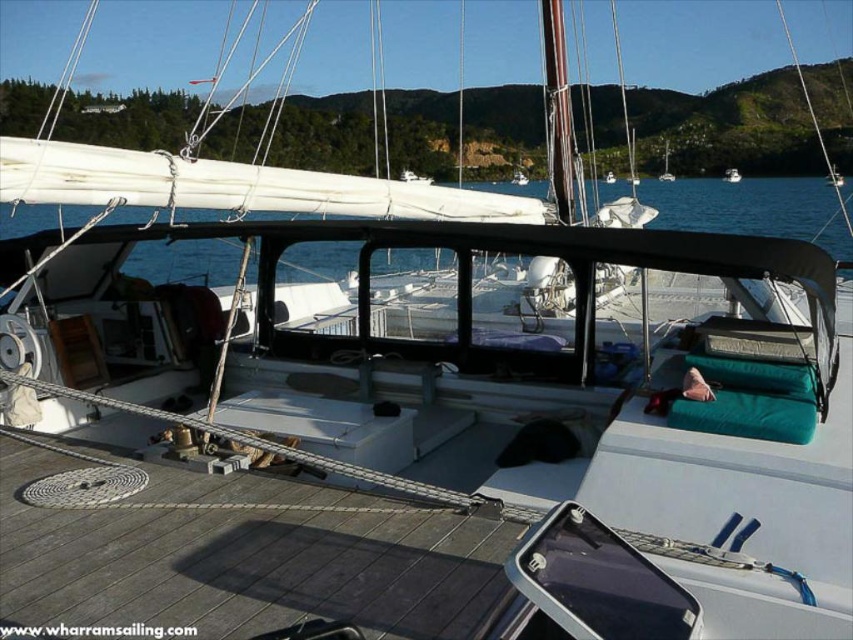
Question: Which point is farther to the camera?

Choices:
 (A) (735, 179)
 (B) (698, 220)

Answer: (A)

Question: Which point appears closest to the camera in this image?

Choices:
 (A) (732, 177)
 (B) (786, 236)

Answer: (B)

Question: Is transparent water at center wider than white matte boat at center?

Choices:
 (A) no
 (B) yes

Answer: (B)

Question: Which point is closer to the camera?

Choices:
 (A) (677, 218)
 (B) (730, 179)

Answer: (A)

Question: Can you confirm if transparent water at center is bigger than white matte boat at center?

Choices:
 (A) yes
 (B) no

Answer: (A)

Question: Can you confirm if transparent water at center is positioned above white matte boat at center?

Choices:
 (A) yes
 (B) no

Answer: (B)